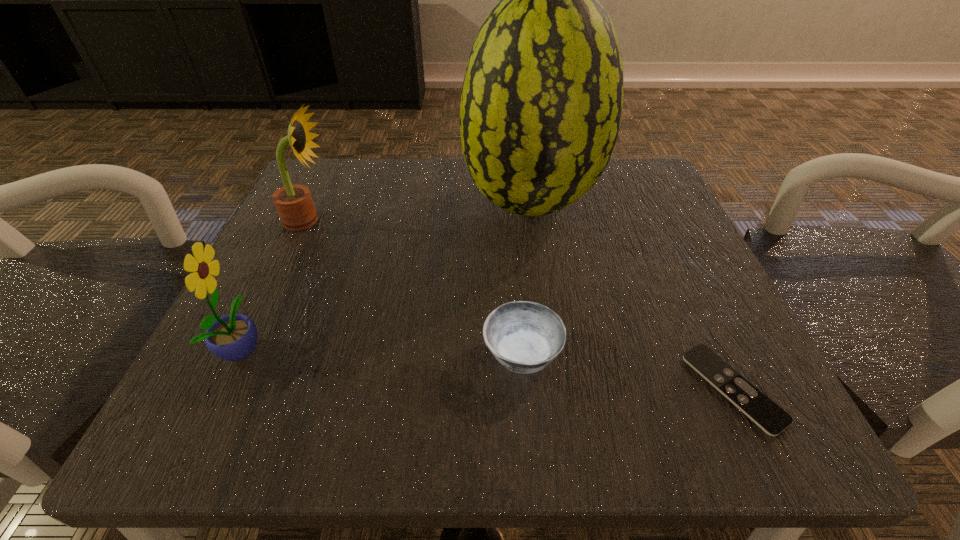
Locate an element on the screen. vacant position in the image that satisfies the following two spatial constraints: 1. on the front-facing side of the ashtray; 2. on the left side of the shorter sunflower is located at coordinates (240, 353).

The image size is (960, 540). Identify the location of vacant region that satisfies the following two spatial constraints: 1. on the face of the taller sunflower; 2. on the back side of the rightmost object. (229, 388).

Where is `vacant space that satisfies the following two spatial constraints: 1. on the face of the farther sunflower; 2. on the right side of the ashtray`? vacant space that satisfies the following two spatial constraints: 1. on the face of the farther sunflower; 2. on the right side of the ashtray is located at coordinates pos(246,353).

At what (x,y) coordinates should I click in order to perform the action: click on blank area in the image that satisfies the following two spatial constraints: 1. on the front-facing side of the third tallest object; 2. on the right side of the fourth tallest object. Please return your answer as a coordinate pair (x, y). Looking at the image, I should click on (240, 353).

Where is `free space that satisfies the following two spatial constraints: 1. on the front side of the watermelon; 2. on the face of the second tallest object`? The image size is (960, 540). free space that satisfies the following two spatial constraints: 1. on the front side of the watermelon; 2. on the face of the second tallest object is located at coordinates (533, 220).